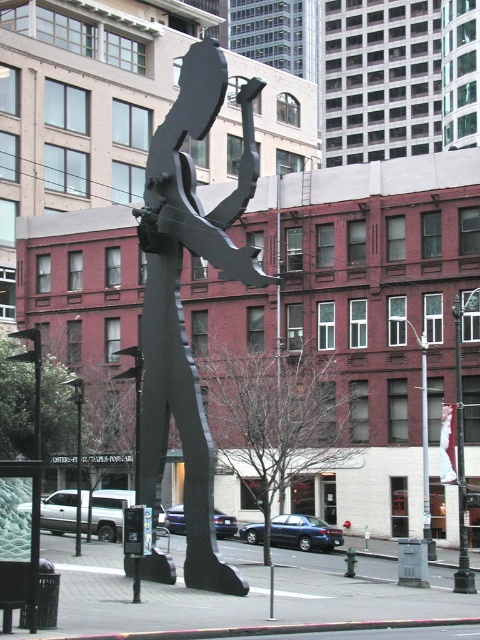
Question: From the image, what is the correct spatial relationship of black metal sculpture at center in relation to metallic pole at center?

Choices:
 (A) below
 (B) above

Answer: (B)

Question: Which object is farther from the camera taking this photo?

Choices:
 (A) metallic pole at center
 (B) black metal sculpture at center

Answer: (A)

Question: Which point is closer to the camera?

Choices:
 (A) metallic pole at center
 (B) black metal sculpture at center

Answer: (B)

Question: Is black metal sculpture at center smaller than metallic pole at center?

Choices:
 (A) yes
 (B) no

Answer: (A)

Question: Among these points, which one is nearest to the camera?

Choices:
 (A) (425, 484)
 (B) (146, 449)

Answer: (B)

Question: Where is black metal sculpture at center located in relation to metallic pole at center in the image?

Choices:
 (A) below
 (B) above

Answer: (B)